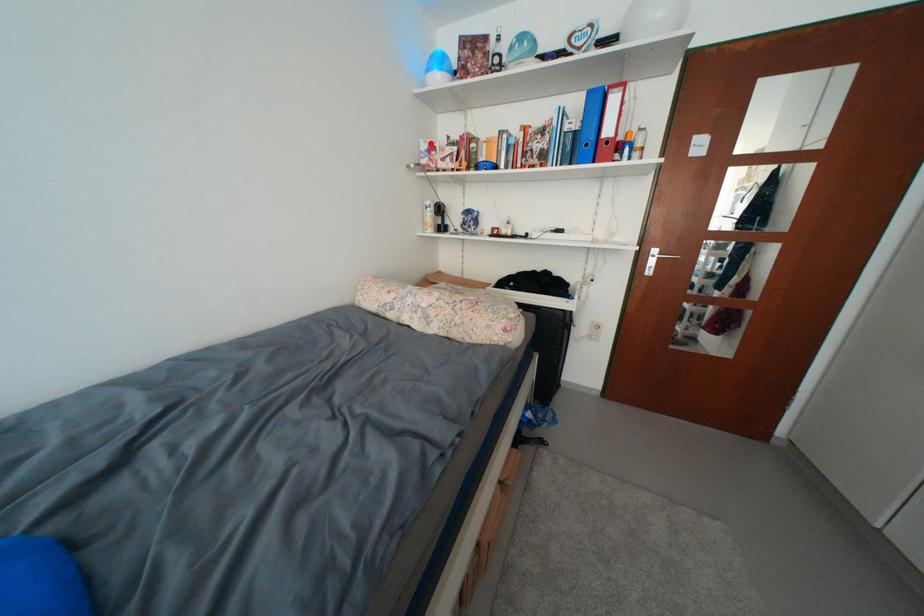
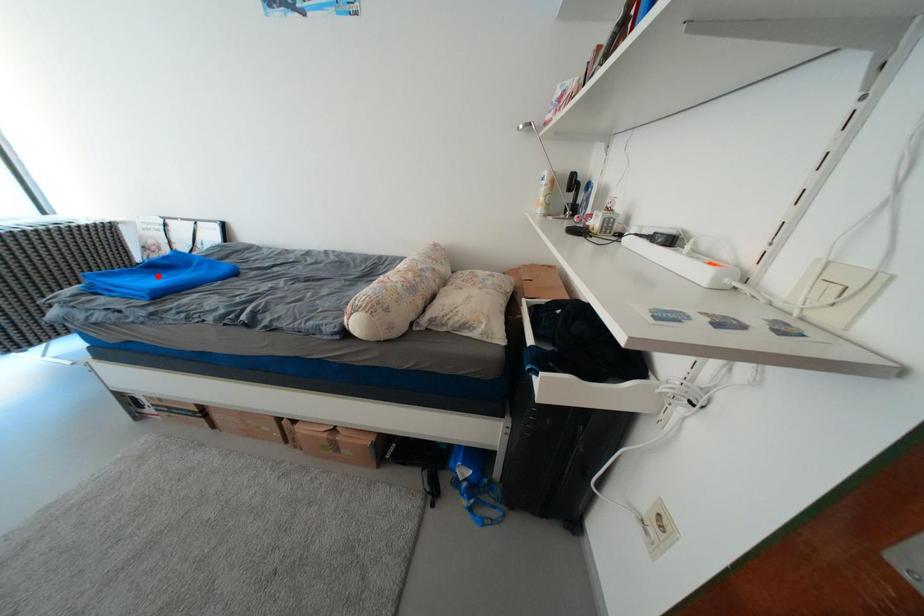
I am providing you with two images of the same scene from different viewpoints. A red point is marked on the first image and another point is marked on the second image. Are the points marked in image1 and image2 representing the same 3D position?

No